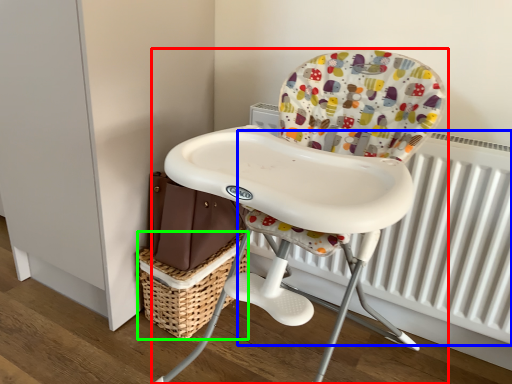
Question: Which object is positioned farthest from chair (highlighted by a red box)? Select from radiator (highlighted by a blue box) and basket (highlighted by a green box).

Choices:
 (A) radiator
 (B) basket

Answer: (B)